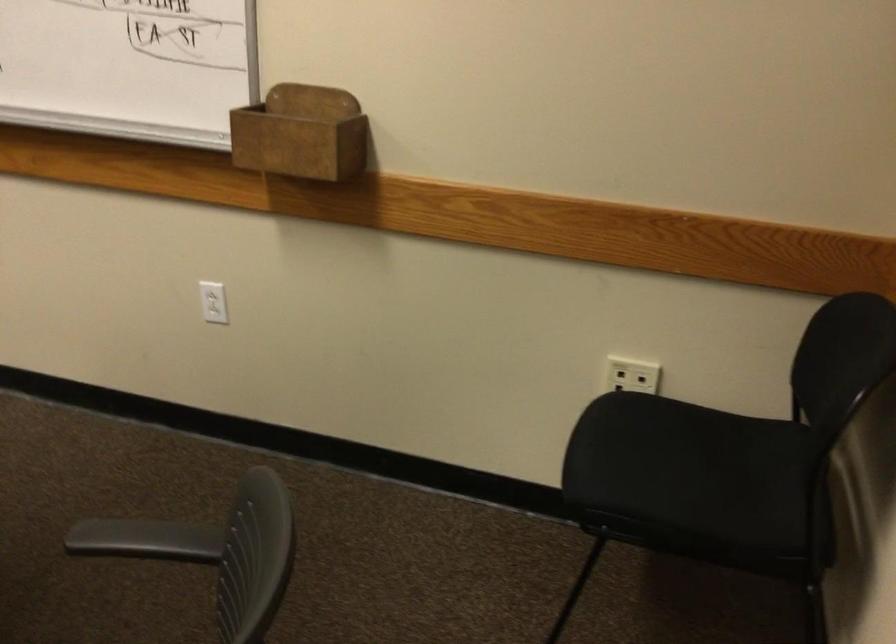
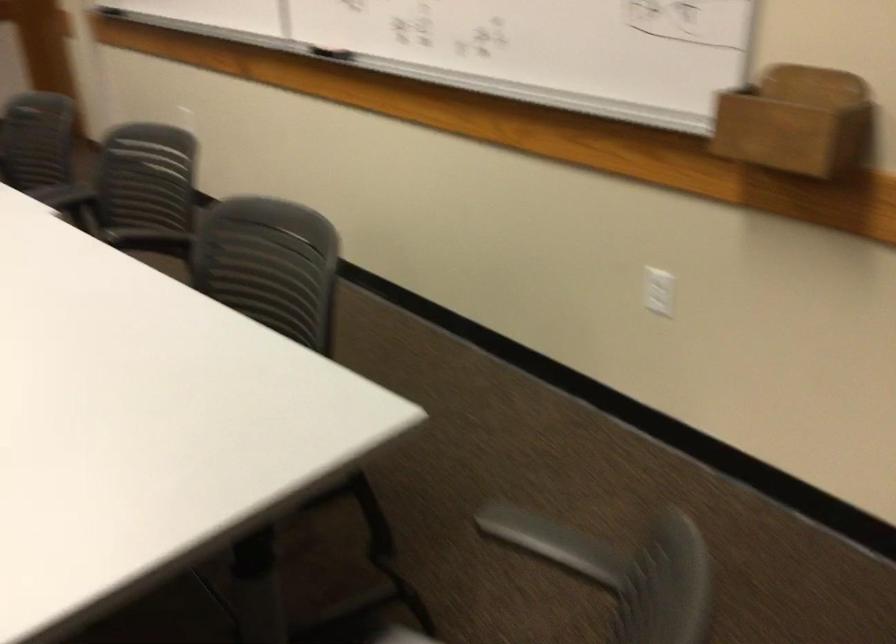
Where in the second image is the point corresponding to pixel 186 521 from the first image?

(552, 538)